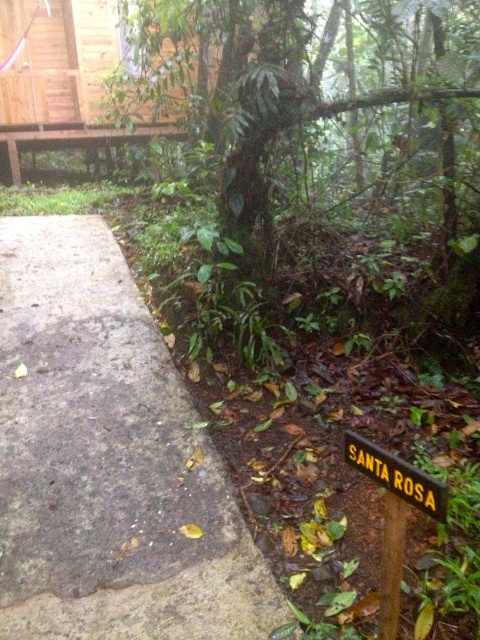
Which of these two, green leafy tree at center or yellowmaterial/texturesign at lower right, stands shorter?

Standing shorter between the two is yellowmaterial/texturesign at lower right.

Between green leafy tree at center and yellowmaterial/texturesign at lower right, which one appears on the left side from the viewer's perspective?

Positioned to the left is green leafy tree at center.

Is point (199, 24) positioned after point (414, 474)?

Yes, it is.

Where is `green leafy tree at center`? The height and width of the screenshot is (640, 480). green leafy tree at center is located at coordinates pyautogui.click(x=254, y=92).

Does gray concrete path at center have a greater height compared to yellowmaterial/texturesign at lower right?

Correct, gray concrete path at center is much taller as yellowmaterial/texturesign at lower right.

Who is positioned more to the left, gray concrete path at center or yellowmaterial/texturesign at lower right?

Positioned to the left is gray concrete path at center.

Is point (250, 621) less distant than point (428, 497)?

No, it is not.

At what (x,y) coordinates should I click in order to perform the action: click on gray concrete path at center. Please return your answer as a coordinate pair (x, y). The width and height of the screenshot is (480, 640). Looking at the image, I should click on (108, 460).

Between gray concrete path at center and green leafy tree at center, which one has more height?

Standing taller between the two is green leafy tree at center.

Is gray concrete path at center smaller than green leafy tree at center?

Yes.

Where is `gray concrete path at center`? gray concrete path at center is located at coordinates (108, 460).